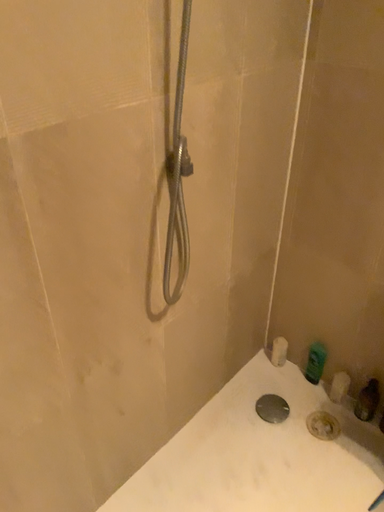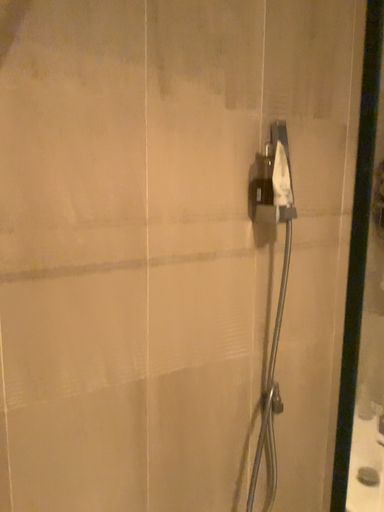
Question: How did the camera likely rotate when shooting the video?

Choices:
 (A) rotated right
 (B) rotated left

Answer: (B)